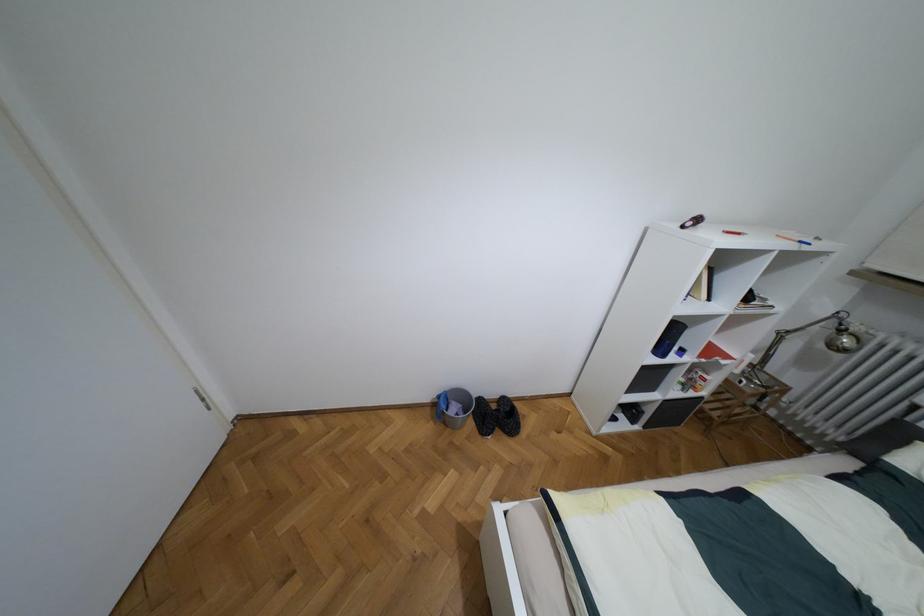
This screenshot has height=616, width=924. Identify the location of silver lamp head. (845, 339).